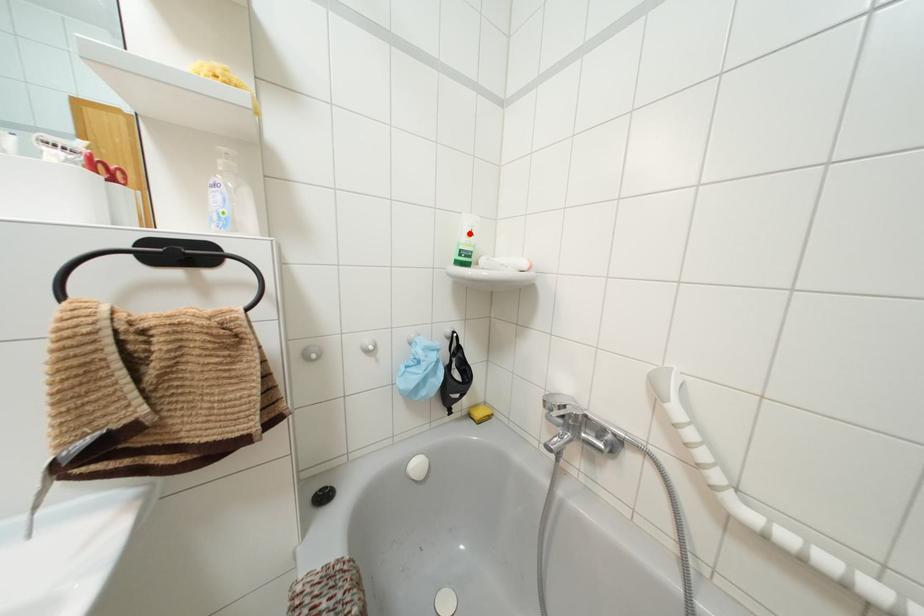
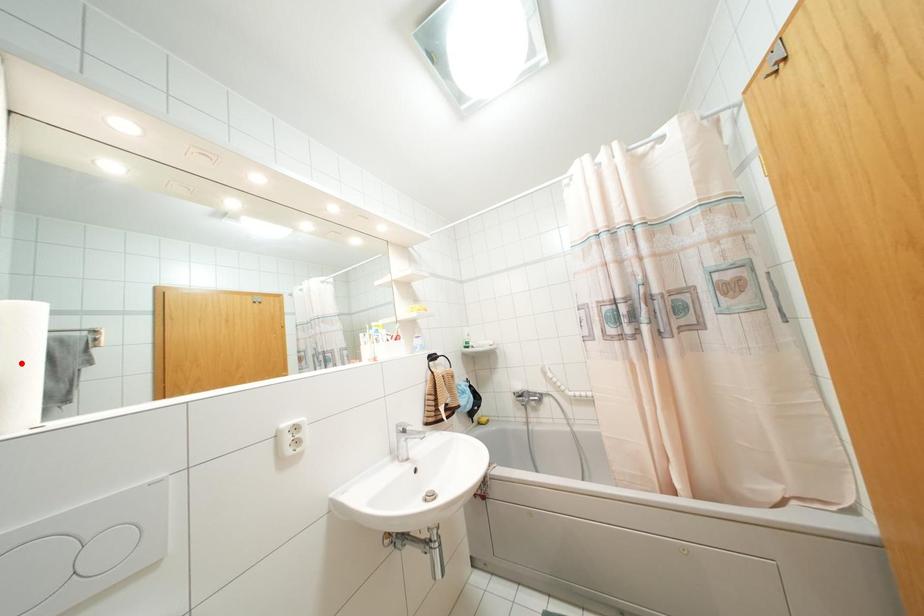
I am providing you with two images of the same scene from different viewpoints. A red point is marked on the first image and another point is marked on the second image. Does the point marked in image1 correspond to the same location as the one in image2?

No